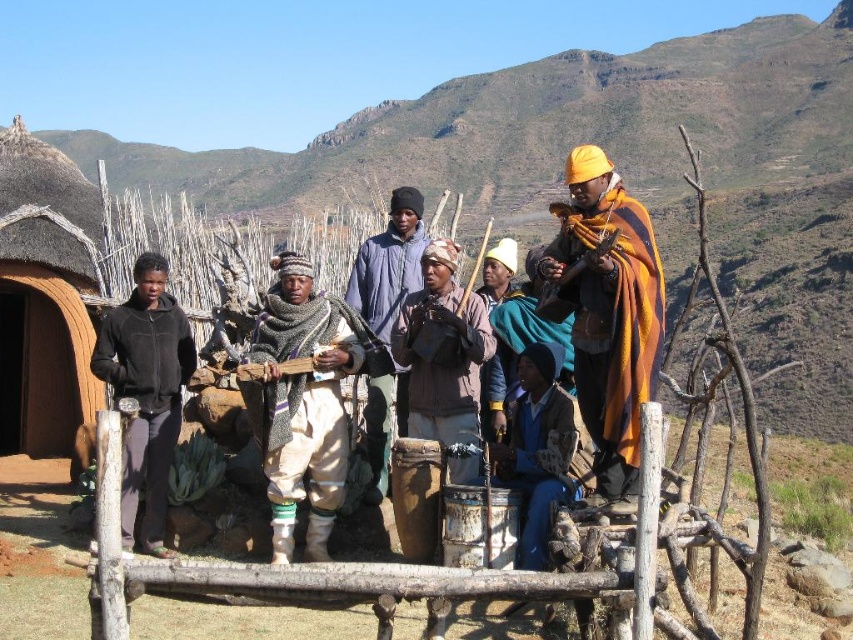
Question: Among these objects, which one is farthest from the camera?

Choices:
 (A) black fleece jacket at left
 (B) wooden fence at center
 (C) knitted woolen hat at center

Answer: (C)

Question: Is knitted woolen scarf at center thinner than knitted woolen hat at center?

Choices:
 (A) no
 (B) yes

Answer: (A)

Question: Can you confirm if orange woolen shawl at center is thinner than knitted woolen hat at center?

Choices:
 (A) yes
 (B) no

Answer: (A)

Question: Is the position of knitted woolen hat at center more distant than that of wooden fence at center?

Choices:
 (A) yes
 (B) no

Answer: (A)

Question: Estimate the real-world distances between objects in this image. Which object is farther from the black fleece jacket at left?

Choices:
 (A) knitted woolen scarf at center
 (B) wooden fence at center
 (C) orange woolen shawl at center

Answer: (B)

Question: Which of the following is the farthest from the observer?

Choices:
 (A) (114, 396)
 (B) (404, 205)
 (C) (331, 401)

Answer: (B)